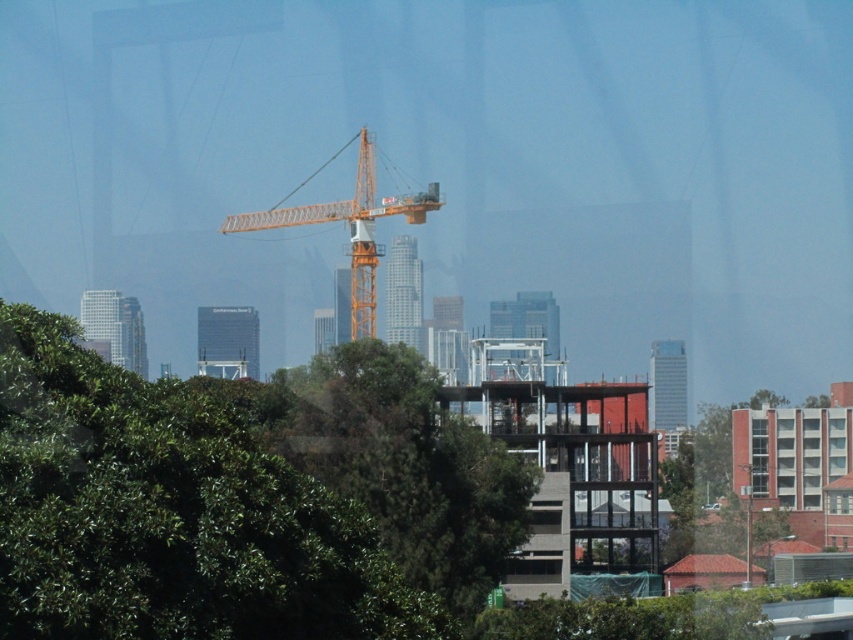
You are a city planner assessing the new construction site. You need to determine if the green leafy tree at center is within a 200 meter safety zone around the orange metallic crane at center. Based on the provided information, is the tree within the safety zone?

The distance between the green leafy tree at center and the orange metallic crane at center is 246.56 meters, which exceeds the 200 meter safety zone. Therefore, the tree is outside the safety zone.

Looking at this image, you are a city planner observing the construction site. You need to determine the visibility of the orange metallic crane at center from the main road. Since the green leafy tree at center is blocking part of the crane, which object is closer to the main road, making the crane less visible?

The green leafy tree at center is closer to the main road than the orange metallic crane at center, so the tree is blocking the crane, making it less visible.